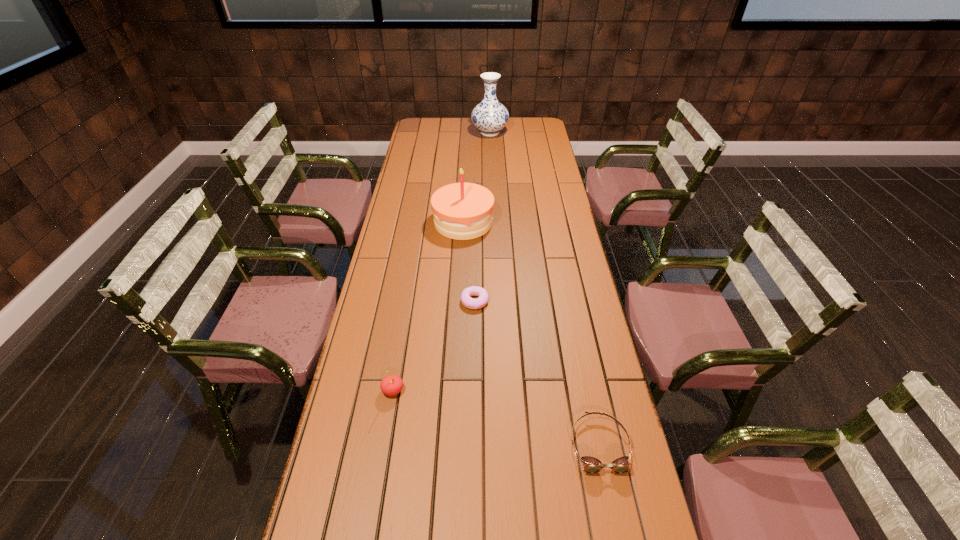
Identify the location of free space between the rightmost object and the farthest object. The image size is (960, 540). (544, 289).

The image size is (960, 540). Identify the location of object that stands as the third closest to the vase. (391, 385).

Identify which object is located as the nearest to the fourth nearest object. Please provide its 2D coordinates. Your answer should be formatted as a tuple, i.e. [(x, y)], where the tuple contains the x and y coordinates of a point satisfying the conditions above.

[(467, 301)]

Locate an element on the screen. This screenshot has height=540, width=960. free space that satisfies the following two spatial constraints: 1. on the front side of the doughnut; 2. on the right side of the birthday cake is located at coordinates [460, 301].

Find the location of a particular element. The height and width of the screenshot is (540, 960). free point that satisfies the following two spatial constraints: 1. on the back side of the third tallest object; 2. on the right side of the second tallest object is located at coordinates (420, 222).

This screenshot has height=540, width=960. Find the location of `vacant space that satisfies the following two spatial constraints: 1. on the front side of the birthday cake; 2. on the right side of the third farthest object`. vacant space that satisfies the following two spatial constraints: 1. on the front side of the birthday cake; 2. on the right side of the third farthest object is located at coordinates (460, 301).

This screenshot has width=960, height=540. I want to click on vacant area in the image that satisfies the following two spatial constraints: 1. on the back side of the doughnut; 2. on the left side of the cherry, so click(408, 301).